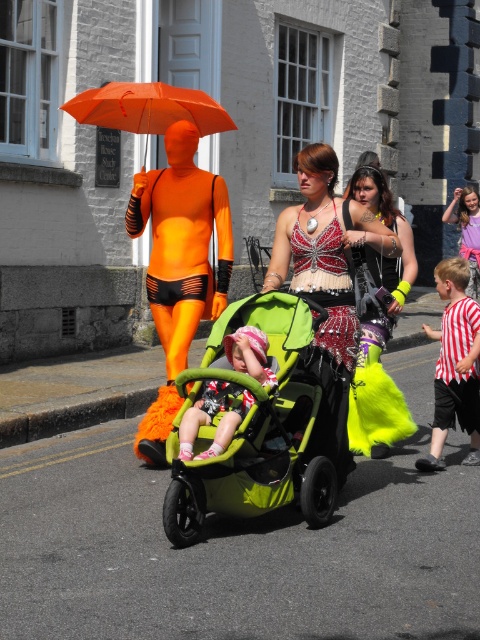
Question: Which of the following is the closest to the observer?

Choices:
 (A) matte pink fabric baby at center
 (B) green matte stroller at center
 (C) bejeweled fabric dress at center

Answer: (B)

Question: Among these points, which one is farthest from the camera?

Choices:
 (A) pyautogui.click(x=232, y=458)
 (B) pyautogui.click(x=323, y=307)
 (C) pyautogui.click(x=381, y=269)

Answer: (C)

Question: Among these objects, which one is nearest to the camera?

Choices:
 (A) striped fabric shirt at right
 (B) matte pink fabric baby at center

Answer: (B)

Question: Considering the relative positions of orange matte umbrella at upper center and matte pink fabric baby at center in the image provided, where is orange matte umbrella at upper center located with respect to matte pink fabric baby at center?

Choices:
 (A) left
 (B) right

Answer: (A)

Question: Does striped fabric shirt at right appear over orange matte umbrella at upper center?

Choices:
 (A) yes
 (B) no

Answer: (B)

Question: Where is shiny metallic dress at center located in relation to striped fabric shirt at right in the image?

Choices:
 (A) below
 (B) above

Answer: (B)